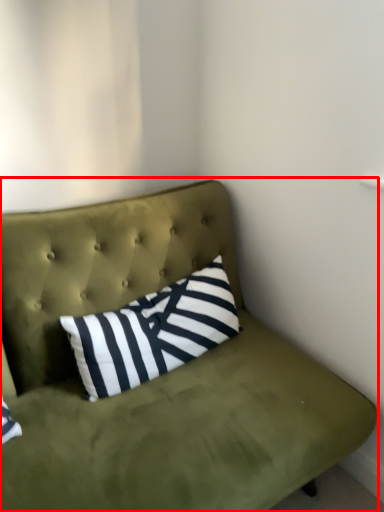
Question: From the image's perspective, what is the correct spatial positioning of studio couch (annotated by the red box) in reference to pillow?

Choices:
 (A) above
 (B) below

Answer: (B)